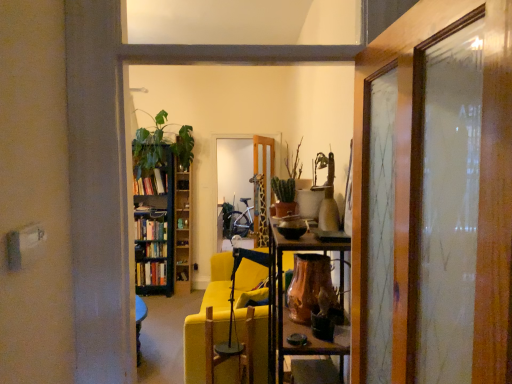
Question: Considering the relative sizes of green matte cactus at center, which appears as the 2th houseplant when viewed from the left, and wooden bookshelf at left in the image provided, is green matte cactus at center, which appears as the 2th houseplant when viewed from the left, thinner than wooden bookshelf at left?

Choices:
 (A) no
 (B) yes

Answer: (B)

Question: From the image's perspective, is green matte cactus at center, which is the first houseplant in front-to-back order, beneath wooden bookshelf at left?

Choices:
 (A) yes
 (B) no

Answer: (B)

Question: Does green matte cactus at center, the second houseplant viewed from the right, appear on the left side of wooden bookshelf at left?

Choices:
 (A) no
 (B) yes

Answer: (A)

Question: Considering the relative sizes of green matte cactus at center, which is counted as the third houseplant, starting from the back, and wooden bookshelf at left in the image provided, is green matte cactus at center, which is counted as the third houseplant, starting from the back, smaller than wooden bookshelf at left?

Choices:
 (A) yes
 (B) no

Answer: (A)

Question: Is green matte cactus at center, which is counted as the third houseplant, starting from the back, aimed at wooden bookshelf at left?

Choices:
 (A) yes
 (B) no

Answer: (B)

Question: From the image's perspective, is glossy wooden door at center located above or below wooden swivel chair at center?

Choices:
 (A) above
 (B) below

Answer: (A)

Question: Looking at the image, does glossy wooden door at center seem bigger or smaller compared to wooden swivel chair at center?

Choices:
 (A) big
 (B) small

Answer: (B)

Question: Does point (266, 147) appear closer or farther from the camera than point (204, 357)?

Choices:
 (A) farther
 (B) closer

Answer: (A)

Question: Is glossy wooden door at center situated inside wooden swivel chair at center or outside?

Choices:
 (A) outside
 (B) inside

Answer: (A)

Question: Is green matte bookcase at left taller or shorter than glossy wooden door at center?

Choices:
 (A) tall
 (B) short

Answer: (A)

Question: Considering the positions of green matte bookcase at left and glossy wooden door at center in the image, is green matte bookcase at left wider or thinner than glossy wooden door at center?

Choices:
 (A) thin
 (B) wide

Answer: (B)

Question: Based on their positions, is green matte bookcase at left located to the left or right of glossy wooden door at center?

Choices:
 (A) right
 (B) left

Answer: (B)

Question: Is green matte bookcase at left in front of or behind glossy wooden door at center in the image?

Choices:
 (A) front
 (B) behind

Answer: (B)

Question: Visually, is hardcover books at left, the 2th book ordered from the bottom, positioned to the left or to the right of green matte bookcase at left?

Choices:
 (A) left
 (B) right

Answer: (A)

Question: From a real-world perspective, is hardcover books at left, the 2th book ordered from the bottom, physically located above or below green matte bookcase at left?

Choices:
 (A) below
 (B) above

Answer: (B)